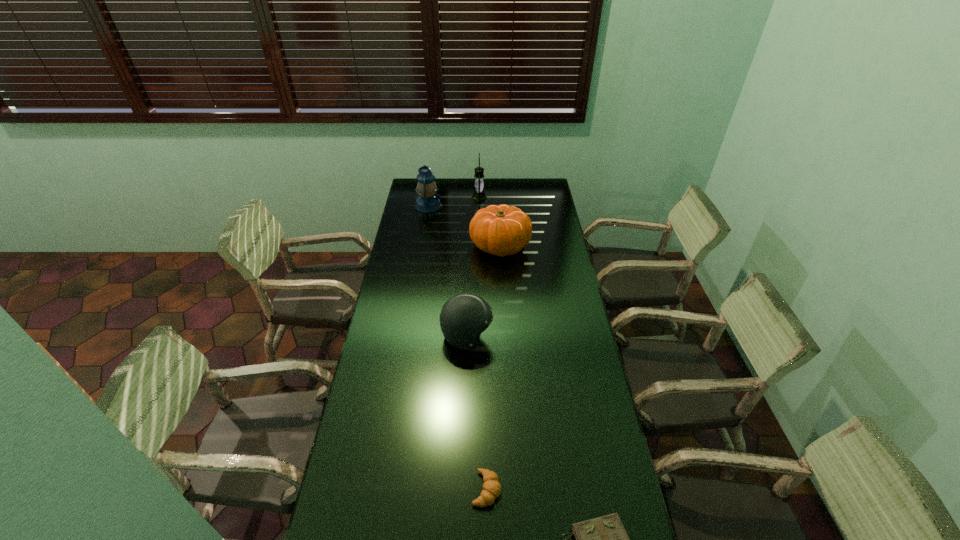
Find the location of a particular element. Image resolution: width=960 pixels, height=540 pixels. the right lantern is located at coordinates (478, 194).

I want to click on the leftmost object, so click(x=428, y=201).

Locate an element on the screen. The height and width of the screenshot is (540, 960). pumpkin is located at coordinates (502, 230).

Where is `the fourth farthest object`? the fourth farthest object is located at coordinates (463, 317).

The height and width of the screenshot is (540, 960). I want to click on crescent roll, so click(x=492, y=488).

Where is `free space located on the side where the right lantern emits light`? This screenshot has width=960, height=540. free space located on the side where the right lantern emits light is located at coordinates (499, 197).

At what (x,y) coordinates should I click in order to perform the action: click on free space located 0.360m on the face of the left lantern. Please return your answer as a coordinate pair (x, y). The height and width of the screenshot is (540, 960). Looking at the image, I should click on (508, 206).

Identify the location of vacant space situated 0.250m on the front of the pumpkin. This screenshot has width=960, height=540. (503, 304).

Identify the location of free space located 0.340m at the face opening of the football helmet. Image resolution: width=960 pixels, height=540 pixels. (582, 336).

You are a GUI agent. You are given a task and a screenshot of the screen. Output one action in this format:
    pyautogui.click(x=<x>, y=<y>)
    Task: Click on the vacant space located on the back of the fifth farthest object
    This screenshot has height=540, width=960.
    Given the screenshot: What is the action you would take?
    pyautogui.click(x=486, y=424)